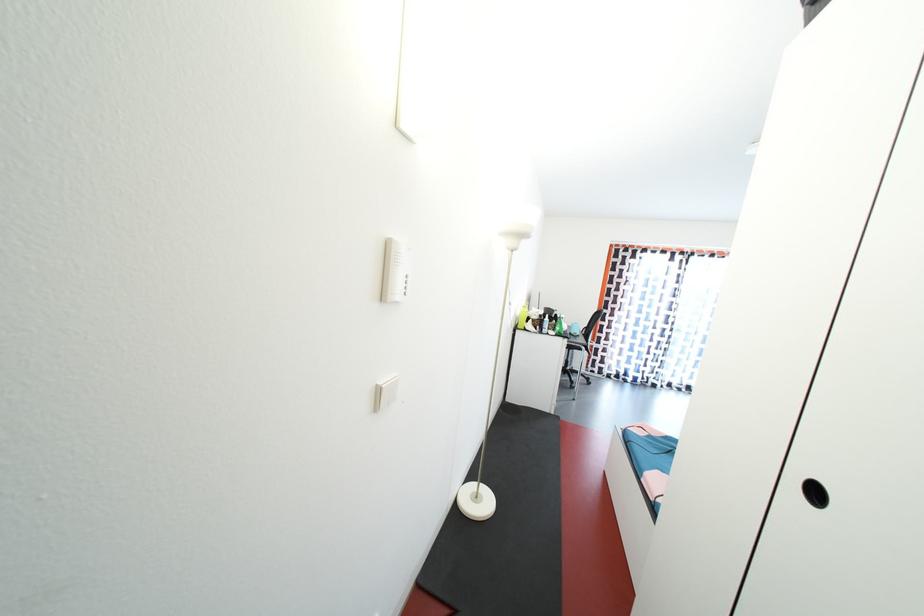
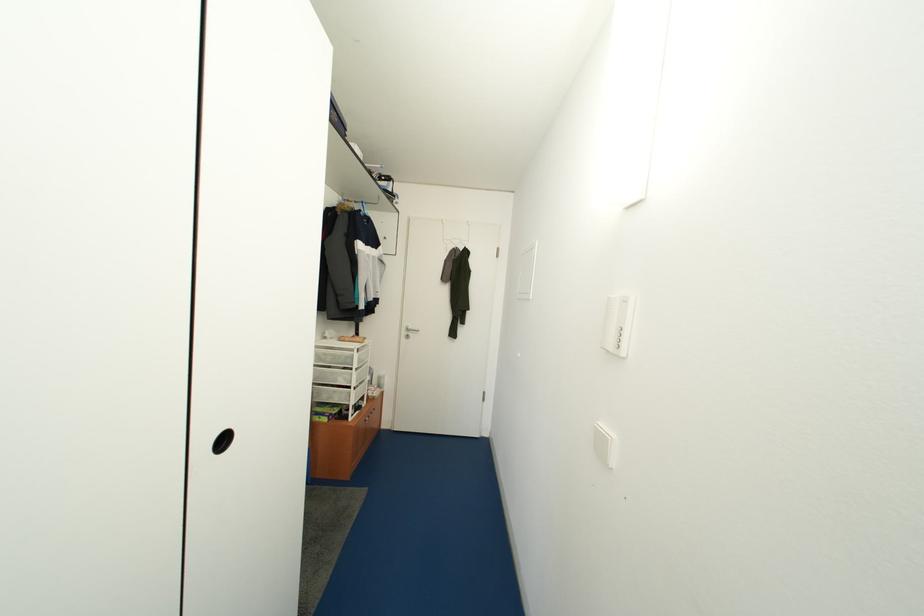
The point at (821, 498) is marked in the first image. Where is the corresponding point in the second image?

(232, 445)